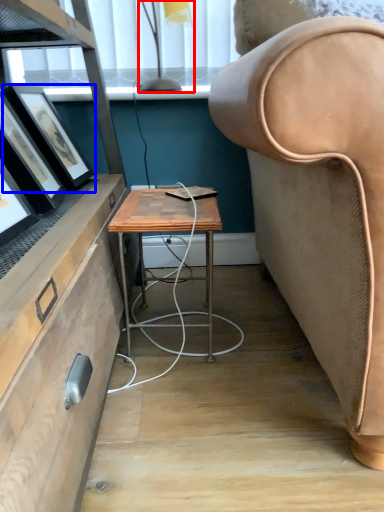
Question: Which point is further to the camera, lamp (highlighted by a red box) or picture frame (highlighted by a blue box)?

Choices:
 (A) lamp
 (B) picture frame

Answer: (A)